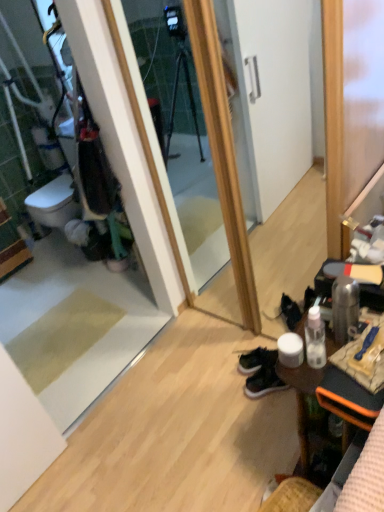
Question: Is green suede sneakers at lower center, which appears as the first footwear when viewed from the front, taller or shorter than wooden desk at lower right?

Choices:
 (A) short
 (B) tall

Answer: (A)

Question: Is green suede sneakers at lower center, marked as the second footwear in a back-to-front arrangement, to the left or to the right of wooden desk at lower right in the image?

Choices:
 (A) left
 (B) right

Answer: (A)

Question: Based on their relative distances, which object is nearer to the green suede sneakers at lower center, which appears as the first footwear when viewed from the front?

Choices:
 (A) dark green suede sneakers at lower right, the 2th footwear viewed from the front
 (B) wooden desk at lower right

Answer: (A)

Question: Considering the real-world distances, which object is farthest from the wooden desk at lower right?

Choices:
 (A) dark green suede sneakers at lower right, arranged as the first footwear when viewed from the back
 (B) green suede sneakers at lower center, marked as the second footwear in a back-to-front arrangement

Answer: (A)